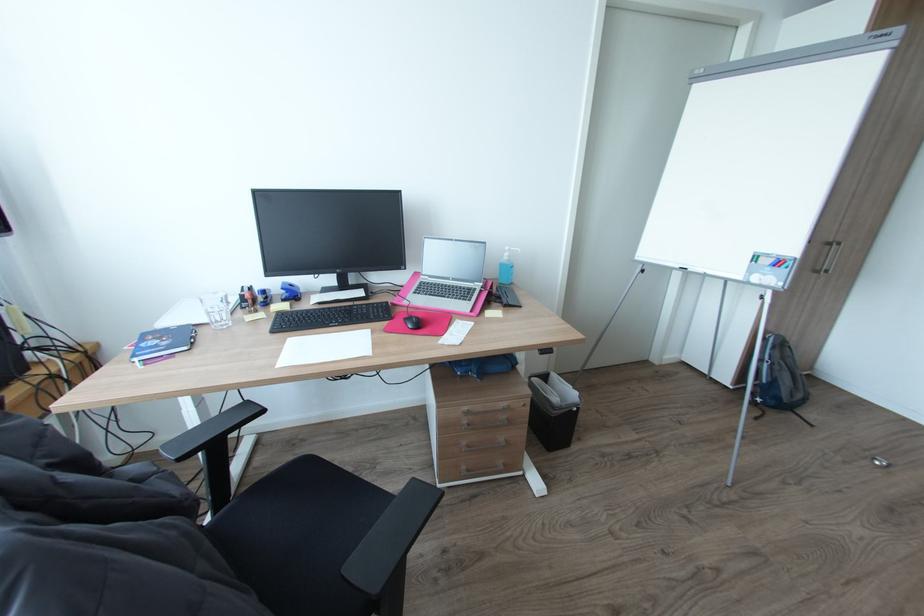
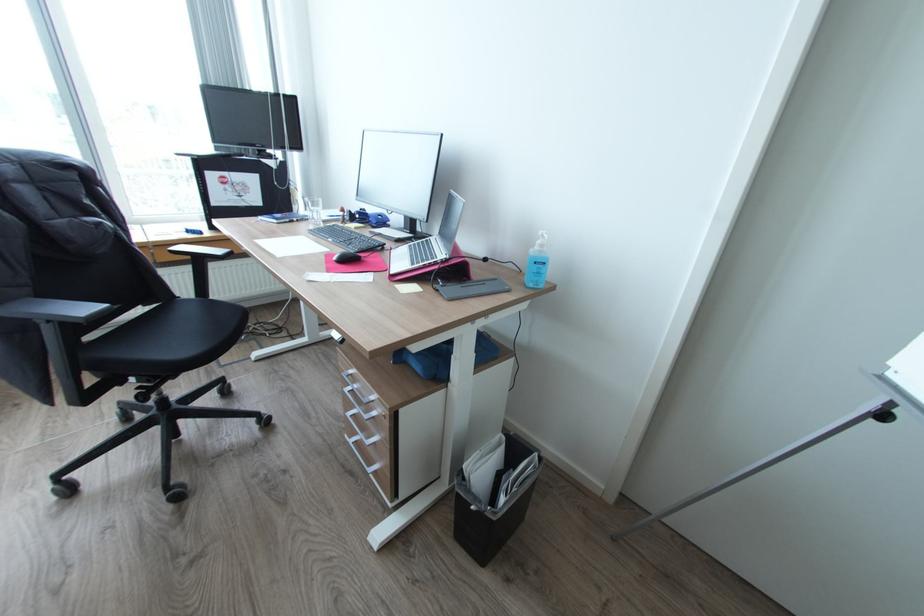
In the second image, find the point that corresponds to (x=426, y=283) in the first image.

(432, 238)